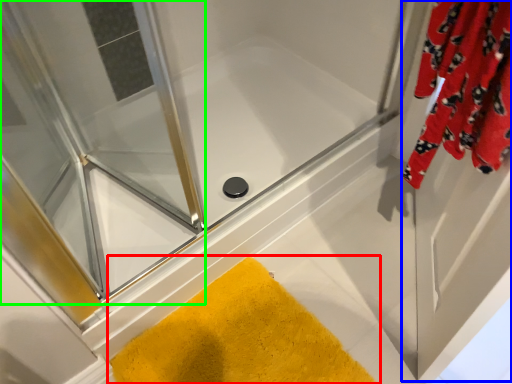
Question: Based on their relative distances, which object is nearer to bath mat (highlighted by a red box)? Choose from screen door (highlighted by a blue box) and screen door (highlighted by a green box).

Choices:
 (A) screen door
 (B) screen door

Answer: (A)